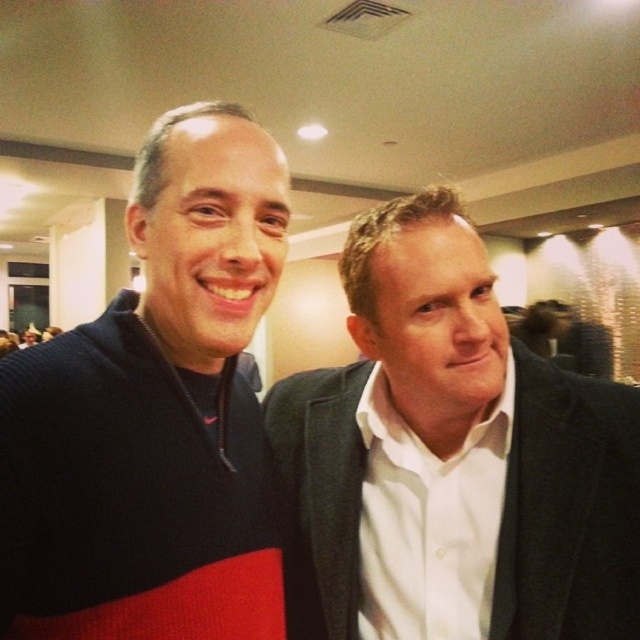
Question: Can you confirm if white matte suit at center is positioned below knit sweater at left?

Choices:
 (A) yes
 (B) no

Answer: (A)

Question: Is white matte suit at center wider than knit sweater at left?

Choices:
 (A) yes
 (B) no

Answer: (A)

Question: Among these objects, which one is farthest from the camera?

Choices:
 (A) white matte suit at center
 (B) knit sweater at left

Answer: (A)

Question: Which point is closer to the camera?

Choices:
 (A) (28, 460)
 (B) (593, 504)

Answer: (A)

Question: Does white matte suit at center have a smaller size compared to knit sweater at left?

Choices:
 (A) no
 (B) yes

Answer: (A)

Question: Which point is closer to the camera taking this photo?

Choices:
 (A) (218, 317)
 (B) (460, 595)

Answer: (A)